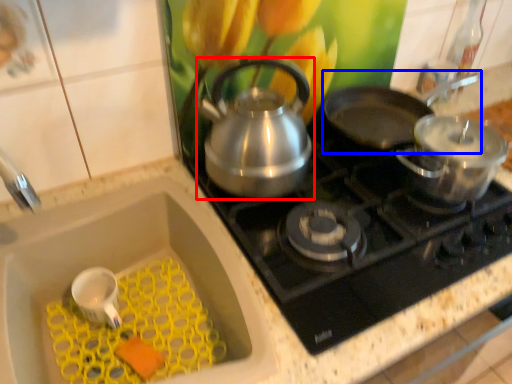
Question: Among these objects, which one is farthest to the camera, kettle (highlighted by a red box) or frying pan (highlighted by a blue box)?

Choices:
 (A) kettle
 (B) frying pan

Answer: (B)